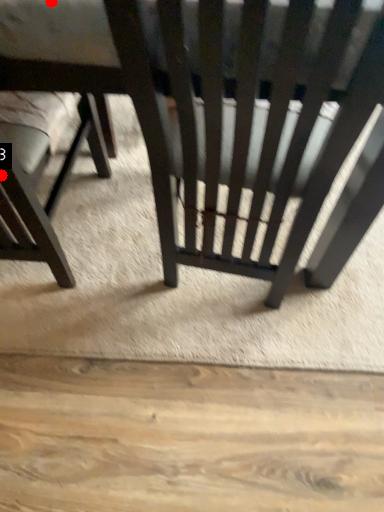
Question: Two points are circled on the image, labeled by A and B beside each circle. Which of the following is the closest to the observer?

Choices:
 (A) A is closer
 (B) B is closer

Answer: (A)